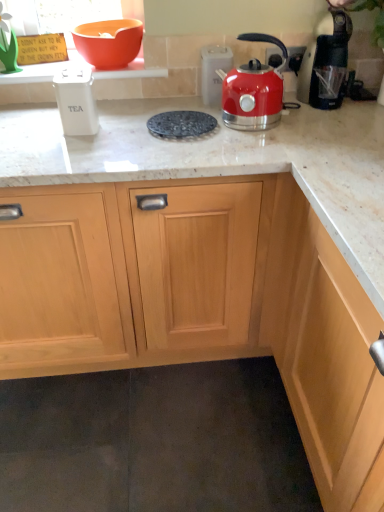
At what (x,y) coordinates should I click in order to perform the action: click on free area in between black plastic coffee maker at upper right, the fourth kitchen appliance in the left-to-right sequence, and shiny metallic kettle at upper right, the second kitchen appliance from the right. Please return your answer as a coordinate pair (x, y). Looking at the image, I should click on (301, 118).